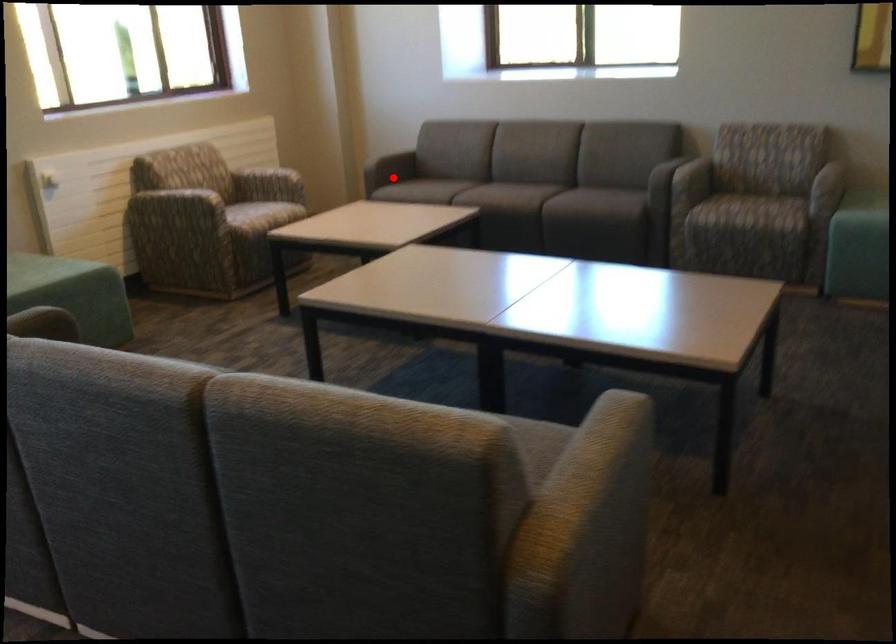
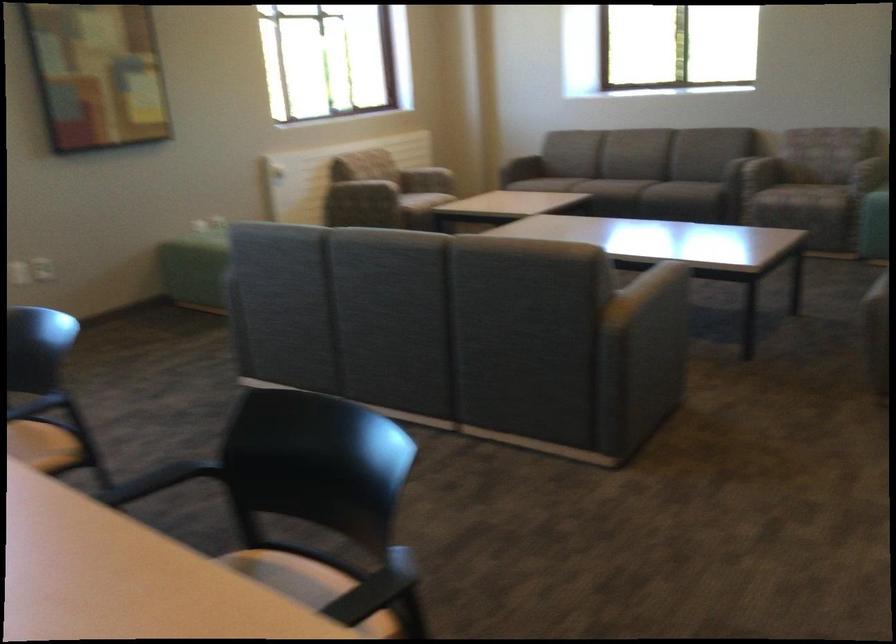
Where in the second image is the point corresponding to the highlighted location from the first image?

(522, 167)